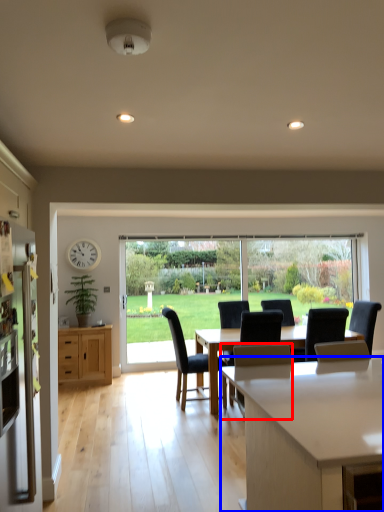
Question: Among these objects, which one is farthest to the camera, chair (highlighted by a red box) or countertop (highlighted by a blue box)?

Choices:
 (A) chair
 (B) countertop

Answer: (A)